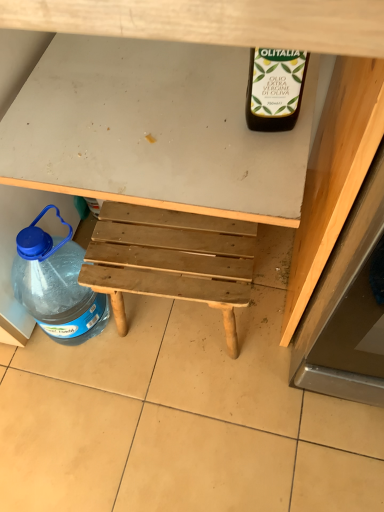
Question: Can you confirm if transparent plastic bottle at lower left is taller than wooden bench at center?

Choices:
 (A) no
 (B) yes

Answer: (A)

Question: Considering the relative positions of transparent plastic bottle at lower left and wooden bench at center in the image provided, is transparent plastic bottle at lower left in front of wooden bench at center?

Choices:
 (A) no
 (B) yes

Answer: (A)

Question: From the image's perspective, is transparent plastic bottle at lower left below wooden bench at center?

Choices:
 (A) yes
 (B) no

Answer: (A)

Question: Is transparent plastic bottle at lower left at the left side of wooden bench at center?

Choices:
 (A) no
 (B) yes

Answer: (B)

Question: Is transparent plastic bottle at lower left oriented towards wooden bench at center?

Choices:
 (A) no
 (B) yes

Answer: (B)

Question: From the image's perspective, is natural wood stool at center positioned above or below wooden bench at center?

Choices:
 (A) above
 (B) below

Answer: (B)

Question: Is natural wood stool at center inside the boundaries of wooden bench at center, or outside?

Choices:
 (A) outside
 (B) inside

Answer: (B)

Question: Is natural wood stool at center wider or thinner than wooden bench at center?

Choices:
 (A) wide
 (B) thin

Answer: (B)

Question: Does point (230, 243) appear closer or farther from the camera than point (309, 42)?

Choices:
 (A) closer
 (B) farther

Answer: (B)

Question: Would you say natural wood stool at center is to the left or to the right of transparent plastic bottle at lower left in the picture?

Choices:
 (A) right
 (B) left

Answer: (A)

Question: In terms of size, does natural wood stool at center appear bigger or smaller than transparent plastic bottle at lower left?

Choices:
 (A) big
 (B) small

Answer: (A)

Question: From the image's perspective, relative to transparent plastic bottle at lower left, is natural wood stool at center above or below?

Choices:
 (A) above
 (B) below

Answer: (A)

Question: Choose the correct answer: Is natural wood stool at center inside transparent plastic bottle at lower left or outside it?

Choices:
 (A) inside
 (B) outside

Answer: (B)

Question: Is wooden bench at center to the left or to the right of transparent plastic bottle at lower left in the image?

Choices:
 (A) right
 (B) left

Answer: (A)

Question: Is wooden bench at center bigger or smaller than transparent plastic bottle at lower left?

Choices:
 (A) big
 (B) small

Answer: (A)